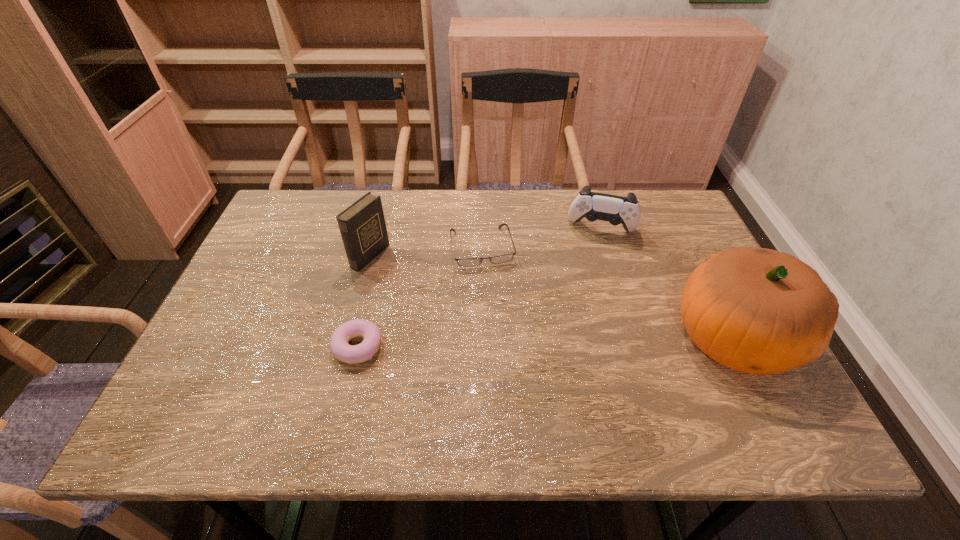
Where is `free spot located on the front-facing side of the spectacles`? Image resolution: width=960 pixels, height=540 pixels. free spot located on the front-facing side of the spectacles is located at coordinates (507, 352).

Where is `free space located on the front-facing side of the spectacles`? free space located on the front-facing side of the spectacles is located at coordinates (503, 335).

Locate an element on the screen. This screenshot has height=540, width=960. free space located 0.400m on the front-facing side of the control is located at coordinates (579, 353).

At what (x,y) coordinates should I click in order to perform the action: click on vacant region located on the front-facing side of the control. Please return your answer as a coordinate pair (x, y). This screenshot has height=540, width=960. Looking at the image, I should click on pos(582,329).

The width and height of the screenshot is (960, 540). Identify the location of vacant space located 0.070m on the front-facing side of the control. (593, 258).

At what (x,y) coordinates should I click in order to perform the action: click on spectacles that is at the far edge. Please return your answer as a coordinate pair (x, y). Looking at the image, I should click on (466, 262).

You are a GUI agent. You are given a task and a screenshot of the screen. Output one action in this format:
    pyautogui.click(x=<x>, y=<y>)
    Task: Click on the control at the far edge
    The height and width of the screenshot is (540, 960).
    Given the screenshot: What is the action you would take?
    pyautogui.click(x=616, y=210)

Locate an element on the screen. doughnut positioned at the near edge is located at coordinates (352, 354).

What are the coordinates of `pumpkin that is at the near edge` in the screenshot? It's located at (759, 311).

Locate an element on the screen. Image resolution: width=960 pixels, height=540 pixels. object that is at the right edge is located at coordinates (759, 311).